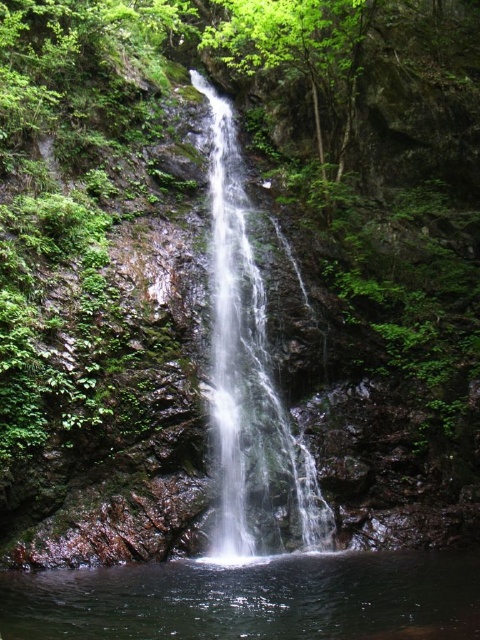
You are standing at the base of the waterfall and want to take a photo. There are two points of interest marked in the image. The first is at coordinates point (75, 618) and the second is at point (232, 333). Which point is closer to you, the photographer?

Point (75, 618) is closer to the camera than point (232, 333), so the first point is closer to you.

You are a hiker who has just arrived at the waterfall. You need to fill your water bottle with the clearest water possible. According to the image, where should you go to collect the clear liquid water at bottom center?

The clear liquid water at bottom center is located at point (252,600), so you should go to that coordinate to collect the clearest water.